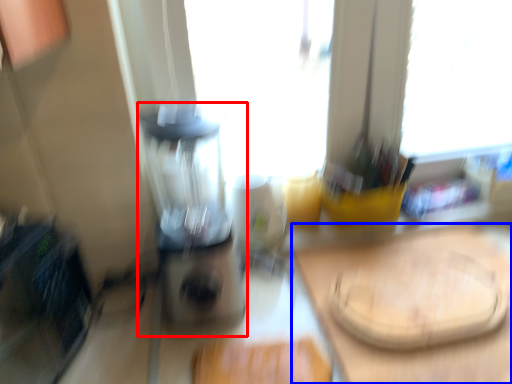
Question: Which object appears closest to the camera in this image, blender (highlighted by a red box) or counter top (highlighted by a blue box)?

Choices:
 (A) blender
 (B) counter top

Answer: (A)